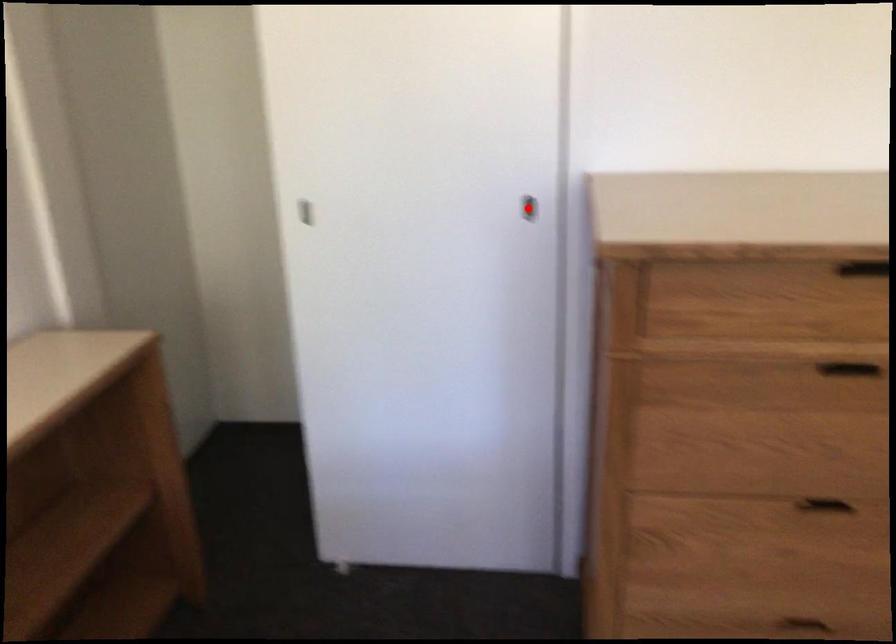
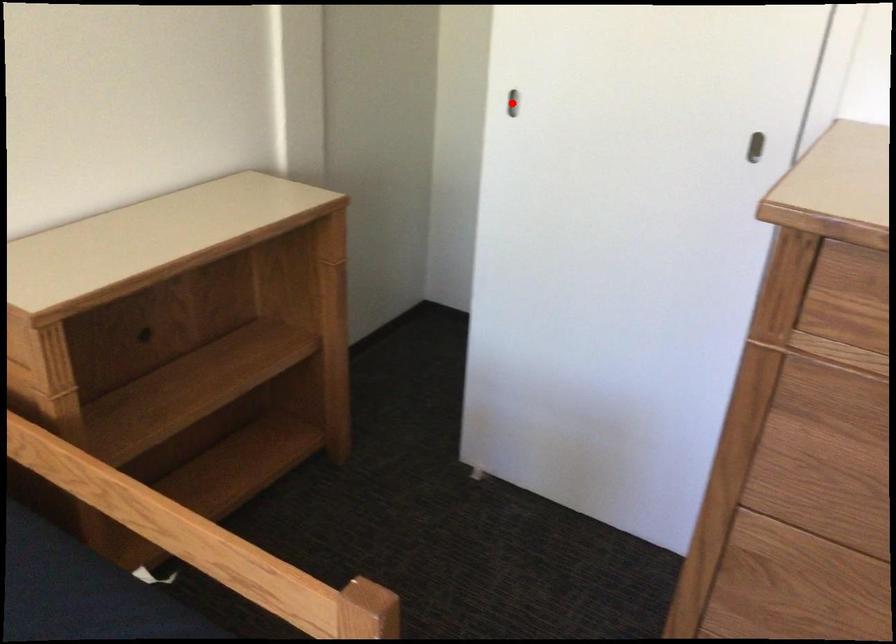
I am providing you with two images of the same scene from different viewpoints. A red point is marked on the first image and another point is marked on the second image. Does the point marked in image1 correspond to the same location as the one in image2?

No